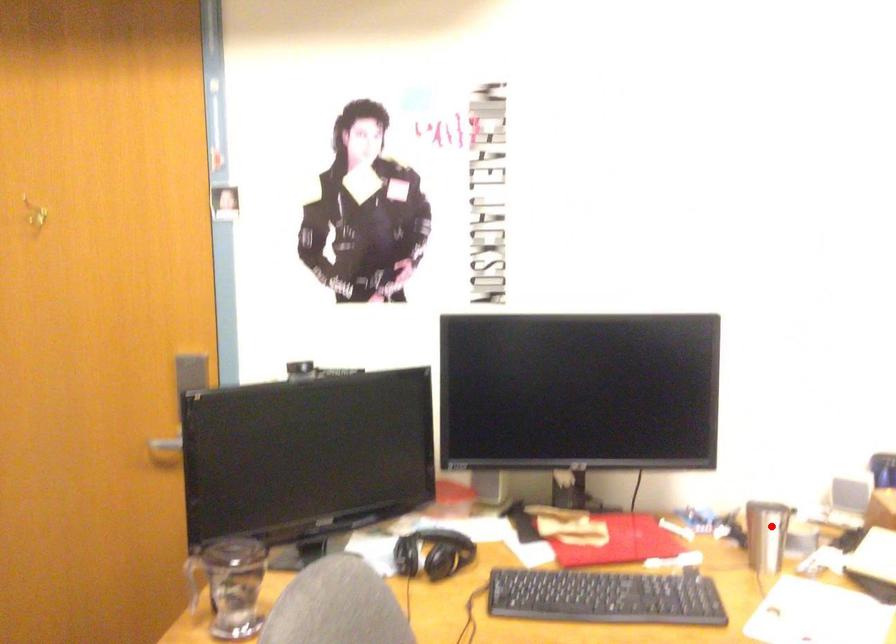
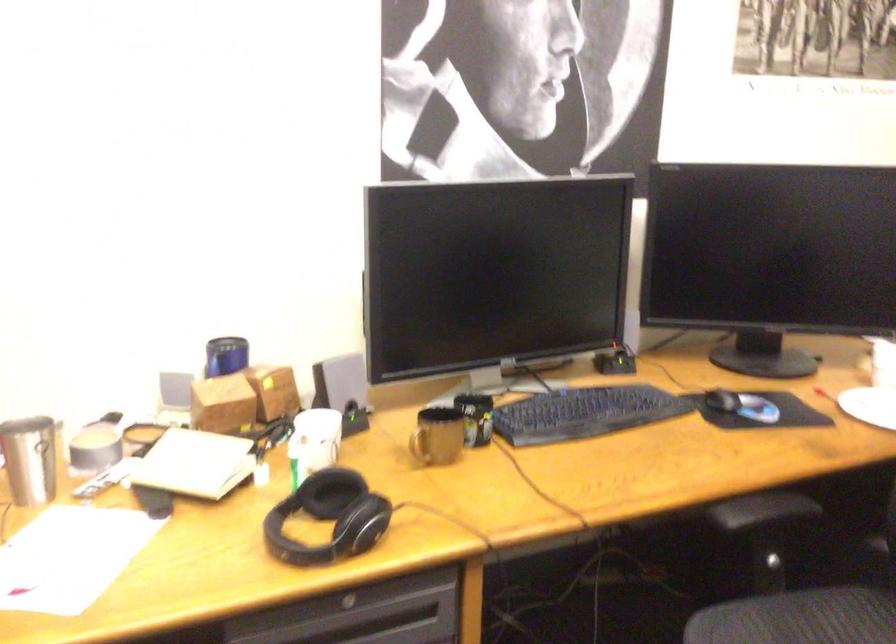
Question: I am providing you with two images of the same scene from different viewpoints. Given a red point in image1, look at the same physical point in image2. Is it:

Choices:
 (A) Closer to the viewpoint
 (B) Farther from the viewpoint

Answer: (A)